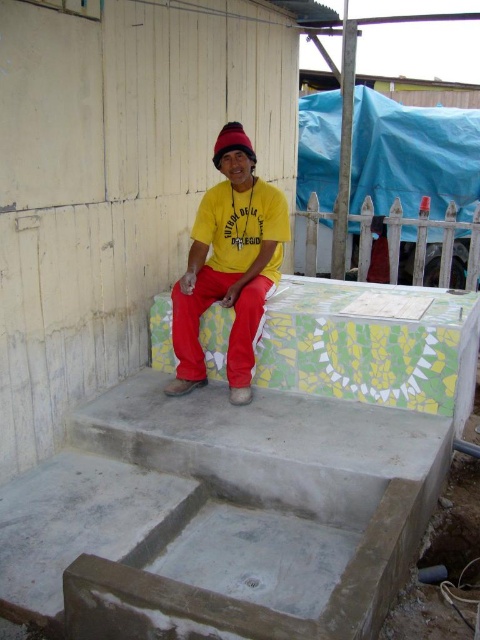
Can you confirm if concrete stairs at center is taller than knitted woolen beanie at center?

Yes, concrete stairs at center is taller than knitted woolen beanie at center.

Which is above, concrete stairs at center or knitted woolen beanie at center?

knitted woolen beanie at center is higher up.

Between point (311, 564) and point (254, 163), which one is positioned in front?

Point (311, 564) is in front.

You are a GUI agent. You are given a task and a screenshot of the screen. Output one action in this format:
    pyautogui.click(x=<x>, y=<y>)
    Task: Click on the concrete stairs at center
    This screenshot has width=480, height=640.
    Given the screenshot: What is the action you would take?
    pyautogui.click(x=230, y=509)

From the picture: Is yellow matte shirt at center bigger than knitted woolen beanie at center?

Yes.

Is yellow matte shirt at center taller than knitted woolen beanie at center?

Indeed, yellow matte shirt at center has a greater height compared to knitted woolen beanie at center.

Locate an element on the screen. The height and width of the screenshot is (640, 480). yellow matte shirt at center is located at coordinates coord(228,266).

Does concrete stairs at center appear on the left side of yellow matte shirt at center?

Correct, you'll find concrete stairs at center to the left of yellow matte shirt at center.

Is point (113, 422) in front of point (278, 216)?

Yes, point (113, 422) is in front of point (278, 216).

The width and height of the screenshot is (480, 640). What do you see at coordinates (230, 509) in the screenshot?
I see `concrete stairs at center` at bounding box center [230, 509].

You are a GUI agent. You are given a task and a screenshot of the screen. Output one action in this format:
    pyautogui.click(x=<x>, y=<y>)
    Task: Click on the concrete stairs at center
    This screenshot has width=480, height=640.
    Given the screenshot: What is the action you would take?
    pyautogui.click(x=230, y=509)